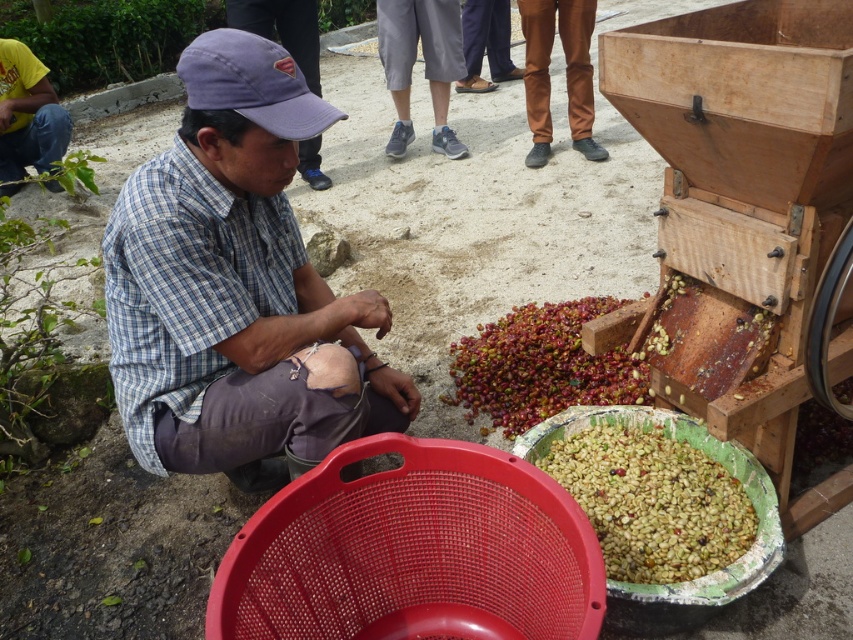
Can you confirm if red plastic mesh basket at lower center is taller than brown corduroy pants at center?

Incorrect, red plastic mesh basket at lower center's height is not larger of brown corduroy pants at center's.

Is the position of red plastic mesh basket at lower center more distant than that of brown corduroy pants at center?

No, red plastic mesh basket at lower center is in front of brown corduroy pants at center.

Does point (426, 476) come in front of point (527, 108)?

Yes, it is.

I want to click on red plastic mesh basket at lower center, so click(x=413, y=552).

Between yellow t-shirt at left and brown leather pants at center, which one has less height?

brown leather pants at center

Is the position of yellow t-shirt at left more distant than that of brown leather pants at center?

No, it is not.

Which is behind, point (36, 64) or point (503, 68)?

The point (503, 68) is more distant.

The image size is (853, 640). What are the coordinates of `yellow t-shirt at left` in the screenshot? It's located at (28, 115).

Which of these two, red plastic mesh basket at lower center or brown leather pants at center, stands shorter?

red plastic mesh basket at lower center is shorter.

From the picture: Can you confirm if red plastic mesh basket at lower center is positioned to the right of brown leather pants at center?

No, red plastic mesh basket at lower center is not to the right of brown leather pants at center.

Describe the element at coordinates (413, 552) in the screenshot. The image size is (853, 640). I see `red plastic mesh basket at lower center` at that location.

The height and width of the screenshot is (640, 853). Find the location of `red plastic mesh basket at lower center`. red plastic mesh basket at lower center is located at coordinates (413, 552).